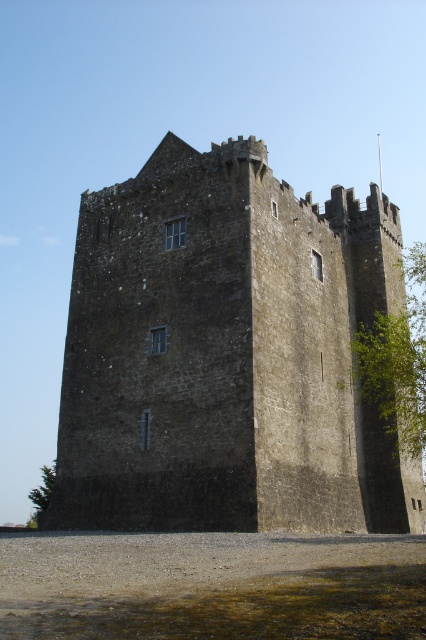
You are standing at the base of the medieval tower and want to take a photo of the green leafy tree at right. Your camera has a maximum zoom range of 150 feet. Can you capture the tree in clear detail without moving closer?

The green leafy tree at right is 149.90 feet from camera, so yes, the camera can capture the tree in clear detail since the distance is within its maximum zoom range of 150 feet.

You are an archer positioned on the crenellations of the rustic stone tower at center. You notice a green leafy tree at right in your line of sight. Which object is higher in elevation?

The rustic stone tower at center is below the green leafy tree at right, so the green leafy tree at right is higher in elevation.